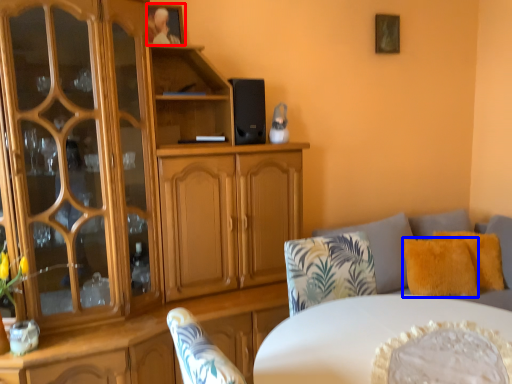
Question: Which object appears farthest to the camera in this image, picture frame (highlighted by a red box) or pillow (highlighted by a blue box)?

Choices:
 (A) picture frame
 (B) pillow

Answer: (B)